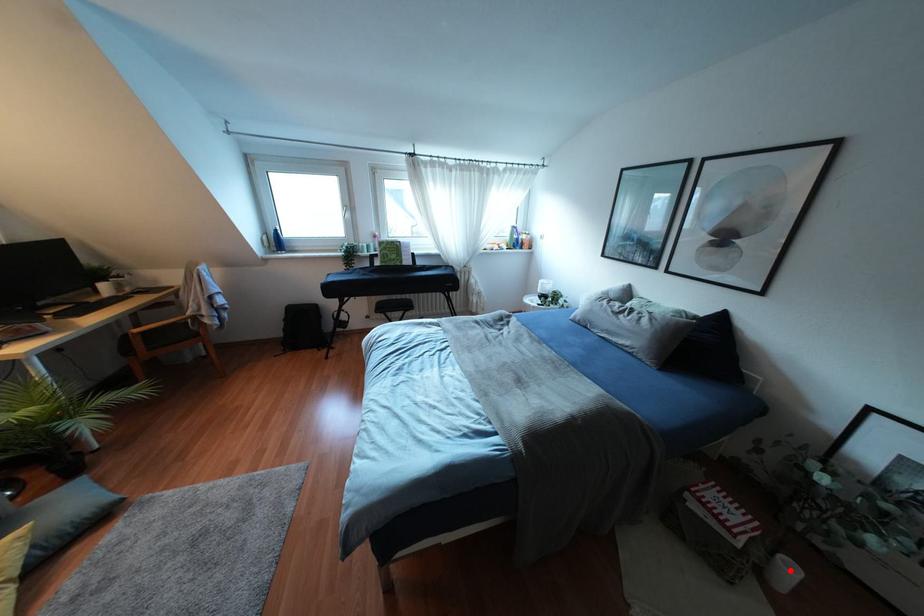
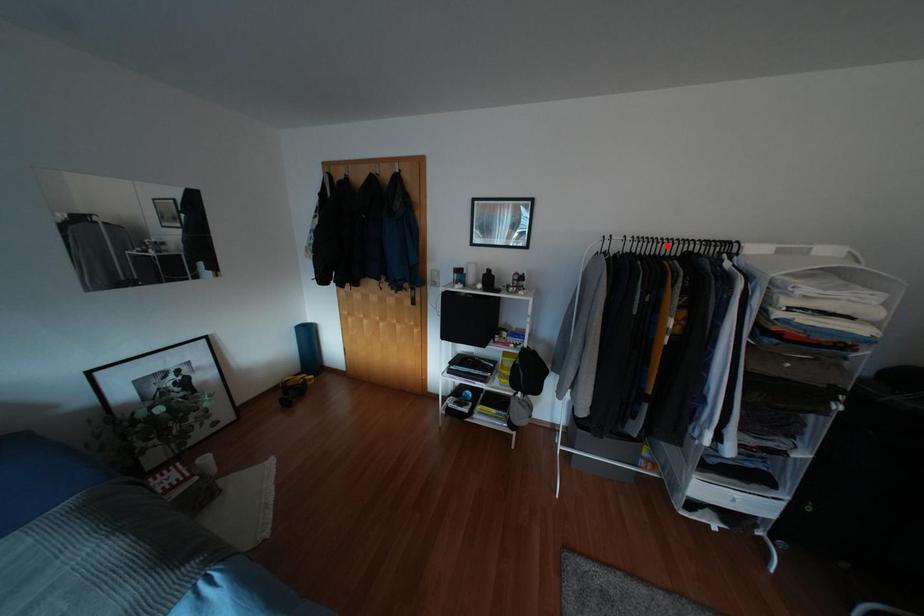
I am providing you with two images of the same scene from different viewpoints. A red point is marked on the first image and another point is marked on the second image. Are the points marked in image1 and image2 representing the same 3D position?

No